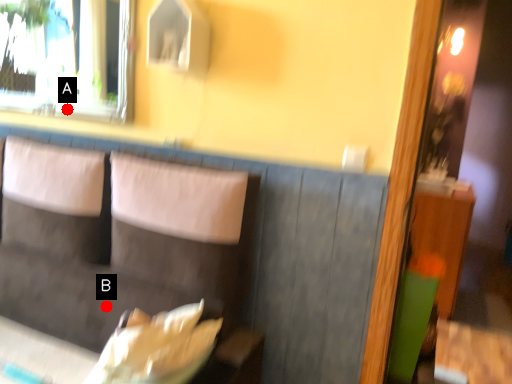
Question: Two points are circled on the image, labeled by A and B beside each circle. Which of the following is the farthest from the observer?

Choices:
 (A) A is further
 (B) B is further

Answer: (A)